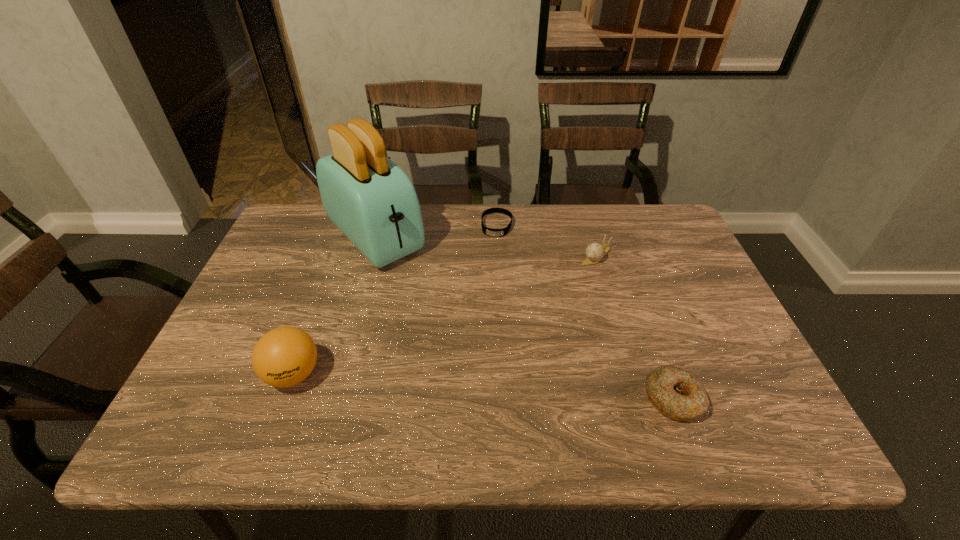
Locate an element on the screen. free space at the right edge of the desktop is located at coordinates (684, 258).

The height and width of the screenshot is (540, 960). Find the location of `vacant space at the near left corner of the desktop`. vacant space at the near left corner of the desktop is located at coordinates (215, 372).

You are a GUI agent. You are given a task and a screenshot of the screen. Output one action in this format:
    pyautogui.click(x=<x>, y=<y>)
    Task: Click on the unoccupied position between the tallest object and the ping-pong ball
    This screenshot has height=540, width=960.
    Given the screenshot: What is the action you would take?
    pyautogui.click(x=334, y=306)

Identify the location of free space between the tallest object and the escargot. (486, 246).

At what (x,y) coordinates should I click in order to perform the action: click on free spot between the escargot and the toaster. Please return your answer as a coordinate pair (x, y). The width and height of the screenshot is (960, 540). Looking at the image, I should click on (486, 246).

Locate an element on the screen. vacant area between the doughnut and the second tallest object is located at coordinates (483, 387).

You are a GUI agent. You are given a task and a screenshot of the screen. Output one action in this format:
    pyautogui.click(x=<x>, y=<y>)
    Task: Click on the empty space that is in between the escargot and the doughnut
    
    Given the screenshot: What is the action you would take?
    pyautogui.click(x=635, y=327)

At what (x,y) coordinates should I click in order to perform the action: click on free spot between the wristband and the doughnut. Please return your answer as a coordinate pair (x, y). The width and height of the screenshot is (960, 540). Looking at the image, I should click on (585, 312).

Where is `free space that is in between the fourth shortest object and the escargot`? This screenshot has width=960, height=540. free space that is in between the fourth shortest object and the escargot is located at coordinates coord(444,315).

You are a GUI agent. You are given a task and a screenshot of the screen. Output one action in this format:
    pyautogui.click(x=<x>, y=<y>)
    Task: Click on the empty space that is in between the third object from left to right and the escargot
    The width and height of the screenshot is (960, 540).
    Given the screenshot: What is the action you would take?
    pyautogui.click(x=546, y=240)